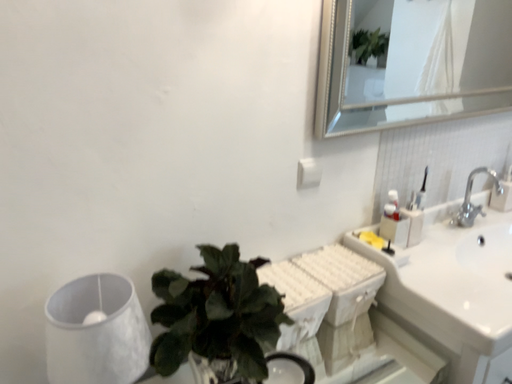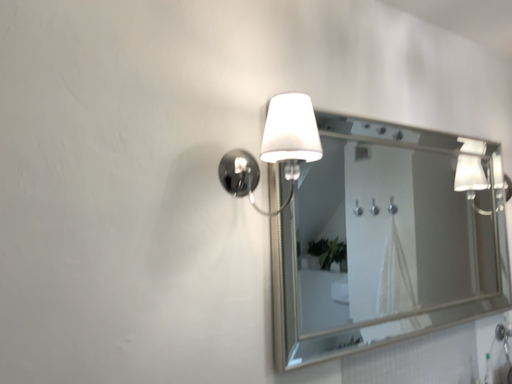
Question: Which way did the camera rotate in the video?

Choices:
 (A) rotated upward
 (B) rotated downward

Answer: (A)